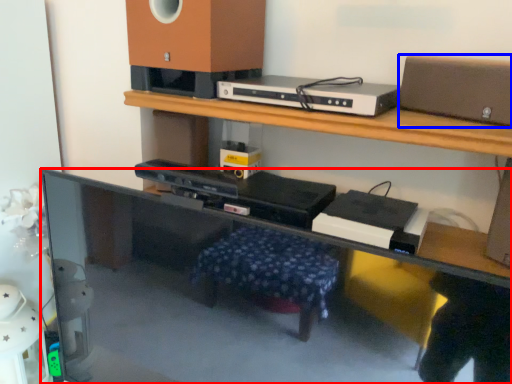
Question: Which object is closer to the camera taking this photo, computer desk (highlighted by a red box) or speaker (highlighted by a blue box)?

Choices:
 (A) computer desk
 (B) speaker

Answer: (A)